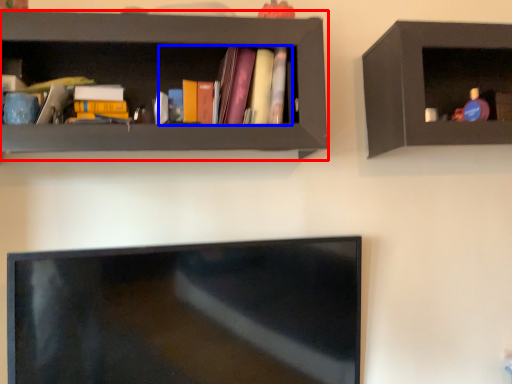
Question: Among these objects, which one is nearest to the camera, shelf (highlighted by a red box) or book (highlighted by a blue box)?

Choices:
 (A) shelf
 (B) book

Answer: (A)